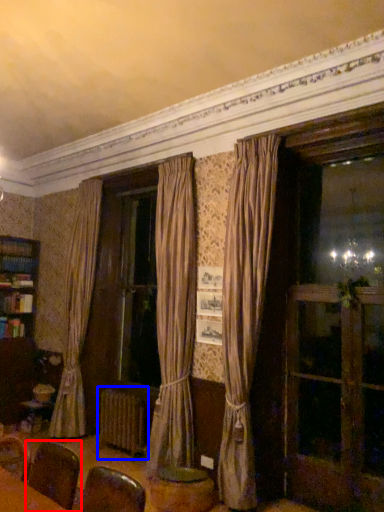
Question: Which of the following is the farthest to the observer, armchair (highlighted by a red box) or radiator (highlighted by a blue box)?

Choices:
 (A) armchair
 (B) radiator

Answer: (B)